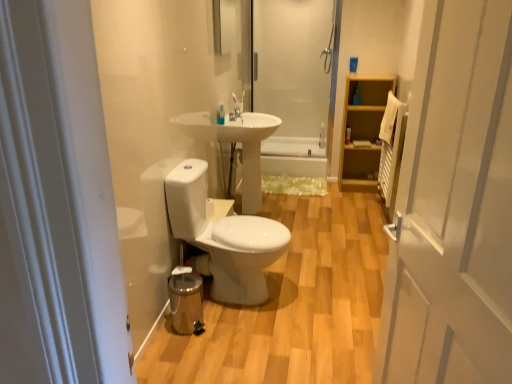
Find the location of a particular element. vacant area that is in front of light wood cabinet at right is located at coordinates (356, 195).